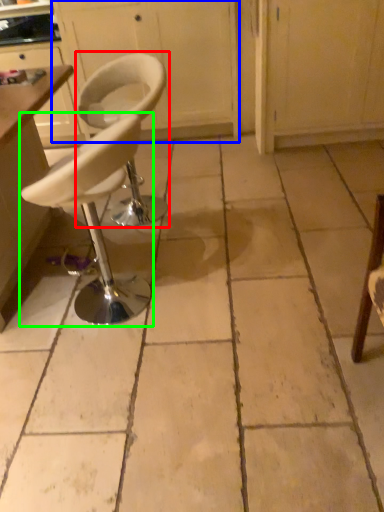
Question: Which object is positioned closest to chair (highlighted by a red box)? Select from cabinetry (highlighted by a blue box) and chair (highlighted by a green box).

Choices:
 (A) cabinetry
 (B) chair

Answer: (B)